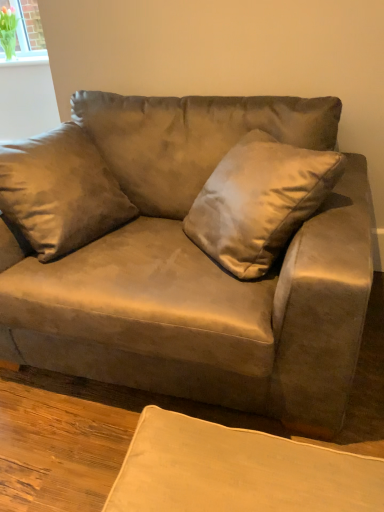
Question: Is clear glass vase at upper left taller than satin gold pillow at center?

Choices:
 (A) no
 (B) yes

Answer: (A)

Question: From the image's perspective, is clear glass vase at upper left on top of satin gold pillow at center?

Choices:
 (A) no
 (B) yes

Answer: (B)

Question: Is clear glass vase at upper left positioned far away from satin gold pillow at center?

Choices:
 (A) no
 (B) yes

Answer: (B)

Question: Is clear glass vase at upper left positioned beyond the bounds of satin gold pillow at center?

Choices:
 (A) yes
 (B) no

Answer: (A)

Question: Is satin gold pillow at center completely or partially inside clear glass vase at upper left?

Choices:
 (A) no
 (B) yes

Answer: (A)

Question: Is clear glass vase at upper left wider than satin gold pillow at center?

Choices:
 (A) yes
 (B) no

Answer: (B)

Question: Does clear glass vase at upper left appear on the right side of suede couch at center?

Choices:
 (A) yes
 (B) no

Answer: (B)

Question: Is clear glass vase at upper left facing towards suede couch at center?

Choices:
 (A) no
 (B) yes

Answer: (A)

Question: Does clear glass vase at upper left lie behind suede couch at center?

Choices:
 (A) yes
 (B) no

Answer: (A)

Question: From the image's perspective, does clear glass vase at upper left appear lower than suede couch at center?

Choices:
 (A) no
 (B) yes

Answer: (A)

Question: Is clear glass vase at upper left taller than suede couch at center?

Choices:
 (A) no
 (B) yes

Answer: (A)

Question: Does clear glass vase at upper left have a smaller size compared to suede couch at center?

Choices:
 (A) yes
 (B) no

Answer: (A)

Question: Is satin gold pillow at center positioned with its back to suede couch at center?

Choices:
 (A) no
 (B) yes

Answer: (B)